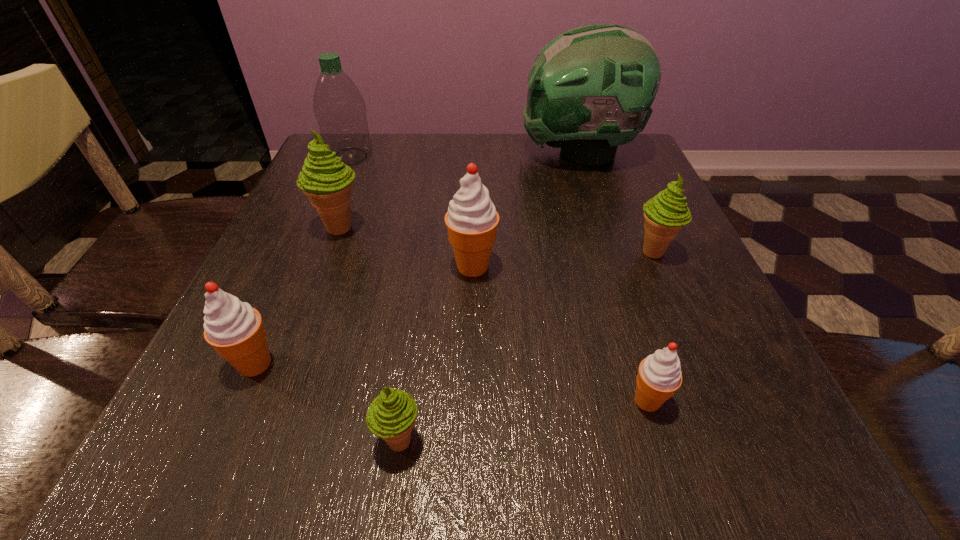
Find the location of a particular element. The image size is (960, 540). green football helmet is located at coordinates (590, 89).

Locate an element on the screen. Image resolution: width=960 pixels, height=540 pixels. football helmet is located at coordinates (590, 89).

Locate an element on the screen. green water bottle is located at coordinates (340, 110).

Locate an element on the screen. the biggest green icecream is located at coordinates (325, 179).

At what (x,y) coordinates should I click in order to perform the action: click on the fourth object from right to left. Please return your answer as a coordinate pair (x, y). Looking at the image, I should click on (472, 220).

Identify the location of the biggest red icecream. (472, 220).

Identify the location of the rightmost icecream. (665, 214).

Identify the location of the second smallest green icecream. This screenshot has width=960, height=540. (665, 214).

Locate an element on the screen. This screenshot has width=960, height=540. the second biggest red icecream is located at coordinates (235, 330).

What are the coordinates of `the rightmost red icecream` in the screenshot? It's located at (659, 376).